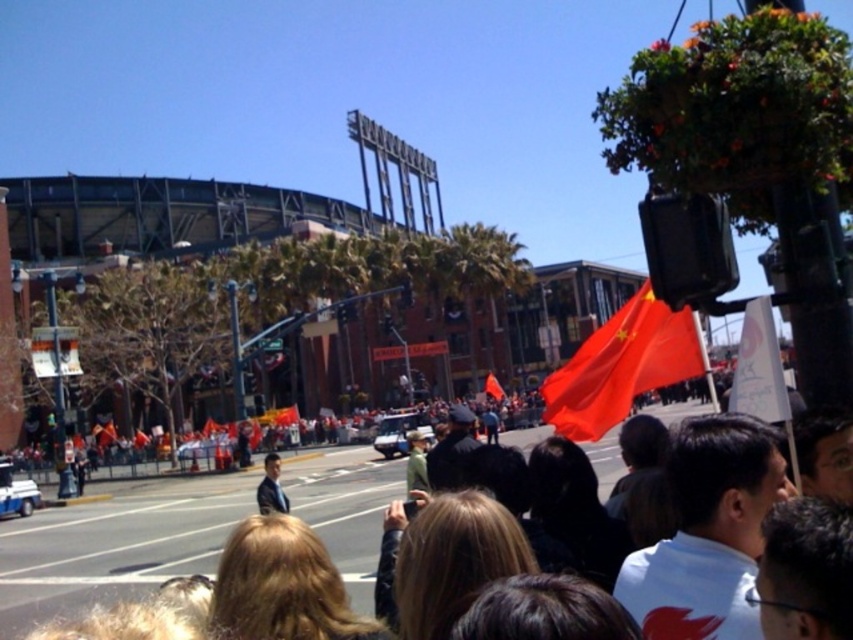
Question: Among these objects, which one is farthest from the camera?

Choices:
 (A) red matte flag at center
 (B) white matte shirt at center
 (C) red fabric flag at center
 (D) dark blue suit at center

Answer: (C)

Question: Is white cotton shirt at center wider than red fabric flag at center?

Choices:
 (A) yes
 (B) no

Answer: (A)

Question: Does white cotton shirt at center have a lesser width compared to white paper sign at upper right?

Choices:
 (A) yes
 (B) no

Answer: (B)

Question: Which object is positioned farthest from the white matte shirt at center?

Choices:
 (A) white paper sign at upper right
 (B) dark blue suit at center
 (C) red matte flag at center

Answer: (B)

Question: From the image, what is the correct spatial relationship of white paper sign at upper right in relation to red fabric flag at center?

Choices:
 (A) right
 (B) left

Answer: (A)

Question: Which point appears farthest from the camera in this image?

Choices:
 (A) (555, 410)
 (B) (286, 500)
 (C) (3, 577)
 (D) (764, 308)

Answer: (B)